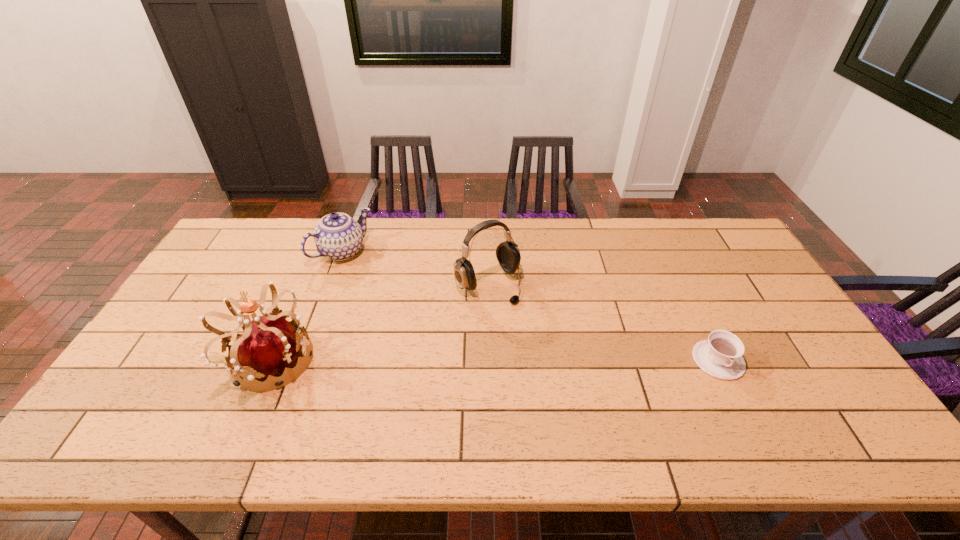
The width and height of the screenshot is (960, 540). Find the location of `object that is the closest to the chinaware`. object that is the closest to the chinaware is located at coordinates (270, 344).